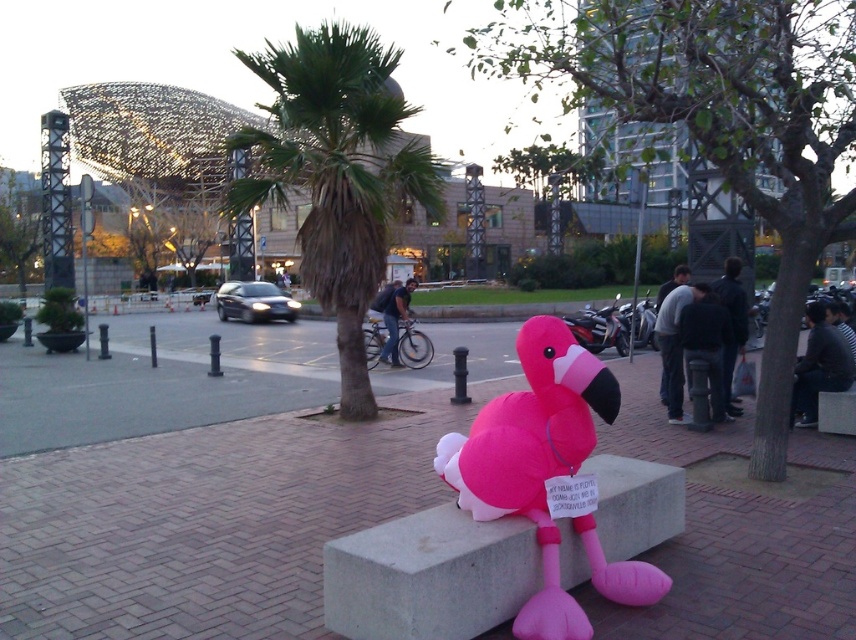
Question: Does pink rubber flamingo at center come behind green leafy palm tree at center?

Choices:
 (A) no
 (B) yes

Answer: (A)

Question: Which object appears closest to the camera in this image?

Choices:
 (A) green leafy palm tree at center
 (B) pink rubber flamingo at center
 (C) pink inflatable flamingo at center

Answer: (C)

Question: Does green leafy palm tree at center come behind pink inflatable flamingo at center?

Choices:
 (A) no
 (B) yes

Answer: (B)

Question: Considering the real-world distances, which object is farthest from the green leafy palm tree at center?

Choices:
 (A) pink inflatable flamingo at center
 (B) pink rubber flamingo at center

Answer: (A)

Question: Considering the relative positions of pink rubber flamingo at center and pink inflatable flamingo at center in the image provided, where is pink rubber flamingo at center located with respect to pink inflatable flamingo at center?

Choices:
 (A) below
 (B) above

Answer: (A)

Question: Which is farther from the green leafy palm tree at center?

Choices:
 (A) pink inflatable flamingo at center
 (B) pink rubber flamingo at center

Answer: (A)